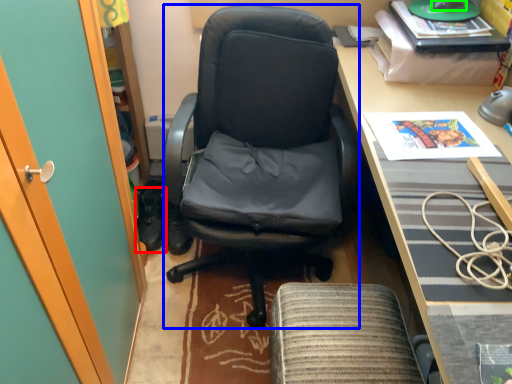
Question: Which object is the farthest from footwear (highlighted by a red box)? Choose among these: chair (highlighted by a blue box) or mouse (highlighted by a green box).

Choices:
 (A) chair
 (B) mouse

Answer: (B)